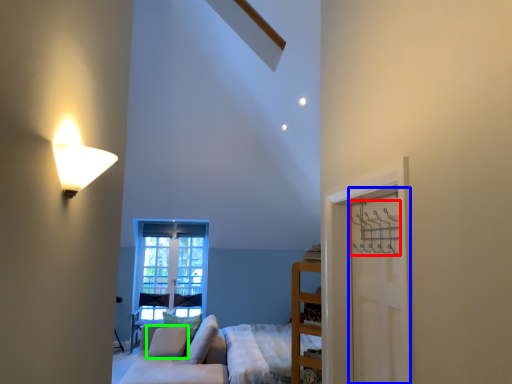
Question: Which object is the farthest from hanger (highlighted by a red box)? Choose among these: door (highlighted by a blue box) or pillow (highlighted by a green box).

Choices:
 (A) door
 (B) pillow

Answer: (B)